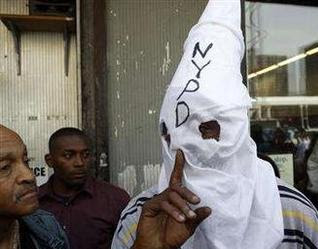
Where is `vent`? vent is located at coordinates (61, 10).